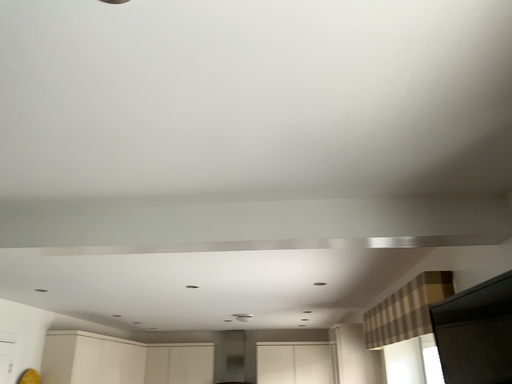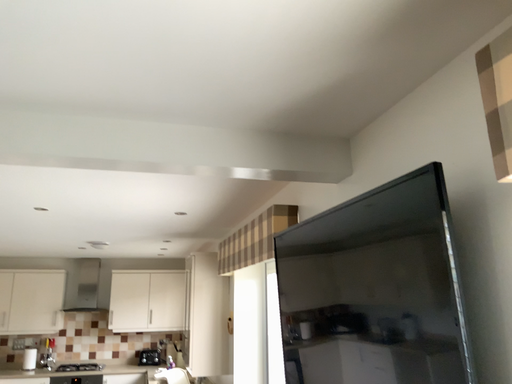
Question: How did the camera likely rotate when shooting the video?

Choices:
 (A) rotated upward
 (B) rotated downward

Answer: (B)